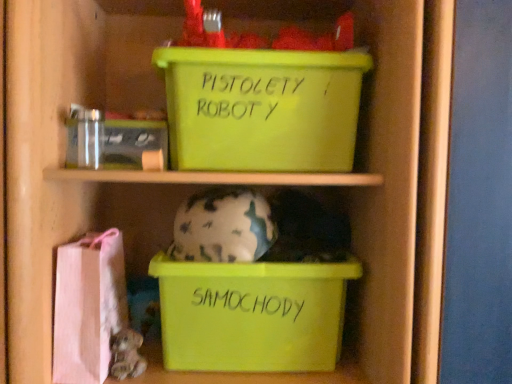
Question: Can you confirm if green plastic storage box at upper center, placed as the 1th storage box when sorted from top to bottom, is positioned to the right of pink fabric bag at lower left?

Choices:
 (A) no
 (B) yes

Answer: (B)

Question: Does green plastic storage box at upper center, placed as the 1th storage box when sorted from top to bottom, have a greater height compared to pink fabric bag at lower left?

Choices:
 (A) yes
 (B) no

Answer: (B)

Question: From a real-world perspective, does green plastic storage box at upper center, placed as the 1th storage box when sorted from top to bottom, sit lower than pink fabric bag at lower left?

Choices:
 (A) no
 (B) yes

Answer: (A)

Question: Could you tell me if green plastic storage box at upper center, positioned as the third storage box in bottom-to-top order, is facing pink fabric bag at lower left?

Choices:
 (A) no
 (B) yes

Answer: (A)

Question: Does green plastic storage box at upper center, placed as the 1th storage box when sorted from top to bottom, have a lesser width compared to pink fabric bag at lower left?

Choices:
 (A) no
 (B) yes

Answer: (A)

Question: From a real-world perspective, is pink fabric bag at lower left physically located above or below matte green plastic box at lower center, the 1th storage box positioned from the bottom?

Choices:
 (A) above
 (B) below

Answer: (A)

Question: Which is correct: pink fabric bag at lower left is inside matte green plastic box at lower center, the 1th storage box positioned from the bottom, or outside of it?

Choices:
 (A) outside
 (B) inside

Answer: (A)

Question: Considering their positions, is pink fabric bag at lower left located in front of or behind matte green plastic box at lower center, the 1th storage box positioned from the bottom?

Choices:
 (A) front
 (B) behind

Answer: (A)

Question: Based on their sizes in the image, would you say pink fabric bag at lower left is bigger or smaller than matte green plastic box at lower center, which is counted as the 3th storage box, starting from the top?

Choices:
 (A) small
 (B) big

Answer: (A)

Question: Relative to camouflage-patterned ceramic piggy bank at center, is matte green plastic box at lower center, the 1th storage box positioned from the bottom, in front or behind?

Choices:
 (A) front
 (B) behind

Answer: (B)

Question: Is point (153, 273) positioned closer to the camera than point (194, 223)?

Choices:
 (A) farther
 (B) closer

Answer: (A)

Question: From the image's perspective, is matte green plastic box at lower center, the 1th storage box positioned from the bottom, positioned above or below camouflage-patterned ceramic piggy bank at center?

Choices:
 (A) above
 (B) below

Answer: (B)

Question: From a real-world perspective, is matte green plastic box at lower center, which is counted as the 3th storage box, starting from the top, physically located above or below camouflage-patterned ceramic piggy bank at center?

Choices:
 (A) above
 (B) below

Answer: (B)

Question: Does point (195, 94) appear closer or farther from the camera than point (202, 281)?

Choices:
 (A) closer
 (B) farther

Answer: (A)

Question: In terms of width, does green plastic storage box at upper center, positioned as the third storage box in bottom-to-top order, look wider or thinner when compared to matte green plastic box at lower center, which is counted as the 3th storage box, starting from the top?

Choices:
 (A) wide
 (B) thin

Answer: (A)